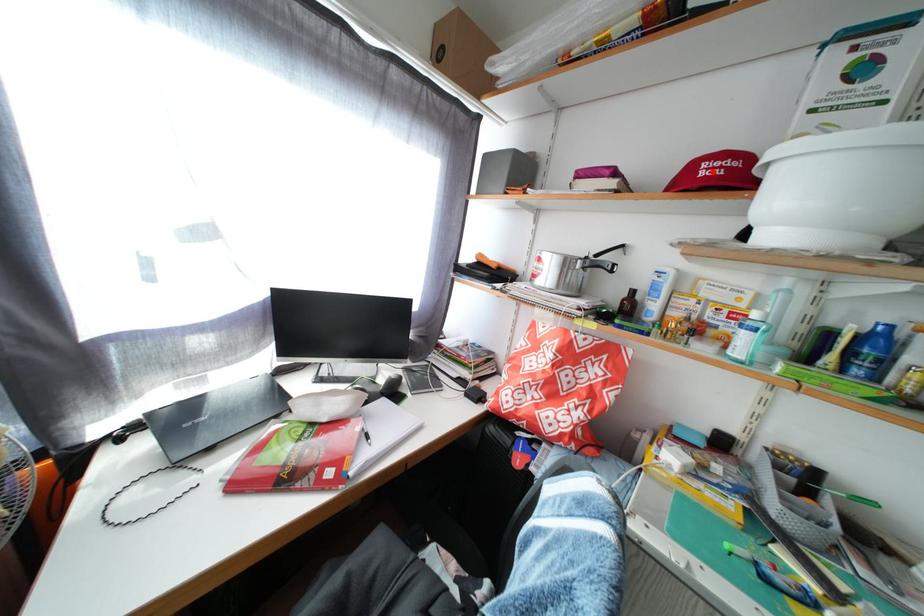
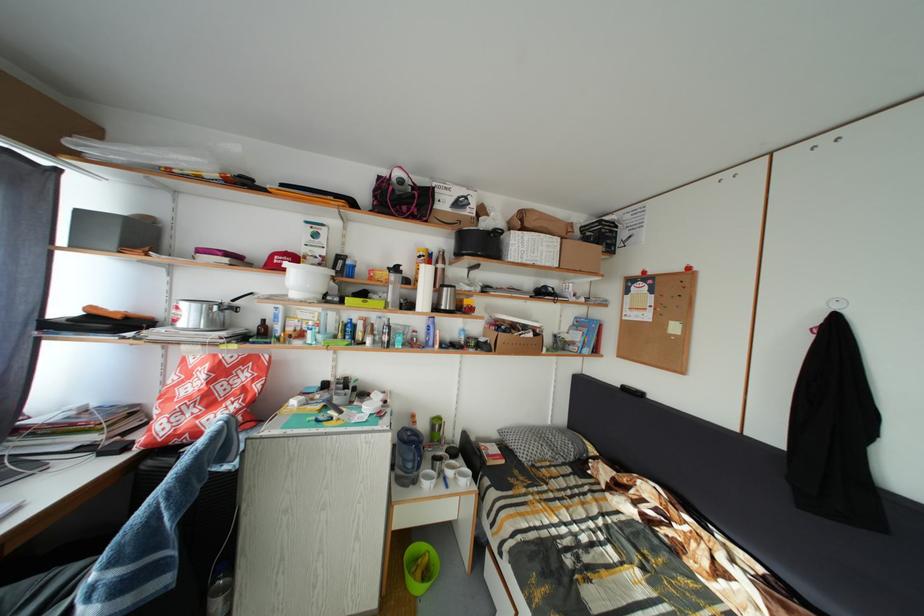
Question: I am providing you with two images of the same scene from different viewpoints. A red point is marked on the first image. Can you still see the location of the red point in image 2?

Choices:
 (A) Yes
 (B) No

Answer: (A)